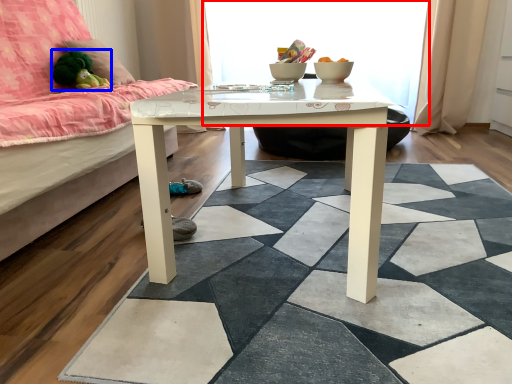
Question: Which point is further to the camera, window screen (highlighted by a red box) or toy (highlighted by a blue box)?

Choices:
 (A) window screen
 (B) toy

Answer: (A)